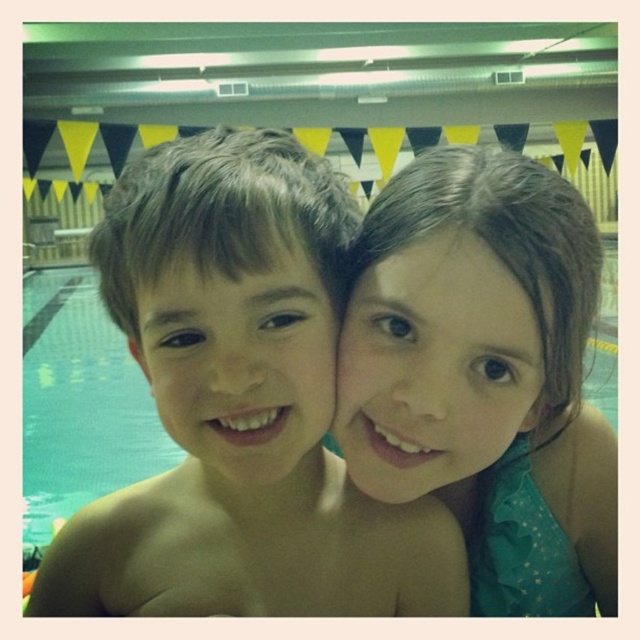
Does point (177, 250) lie in front of point (524, 198)?

That is True.

Who is more distant from viewer, (241, 337) or (616, 464)?

The point (616, 464) is behind.

This screenshot has width=640, height=640. Find the location of `shiny skin boy at center`. shiny skin boy at center is located at coordinates (241, 404).

Is point (467, 349) closer to camera compared to point (221, 432)?

No.

Locate an element on the screen. The width and height of the screenshot is (640, 640). teal fabric swimsuit at right is located at coordinates (484, 374).

Is point (243, 476) positioned in front of point (508, 296)?

Yes, it is.

Between shiny skin boy at center and smooth teal dress at center, which one has more height?

With more height is shiny skin boy at center.

What do you see at coordinates (241, 404) in the screenshot? This screenshot has width=640, height=640. I see `shiny skin boy at center` at bounding box center [241, 404].

Where is `shiny skin boy at center`? This screenshot has width=640, height=640. shiny skin boy at center is located at coordinates (241, 404).